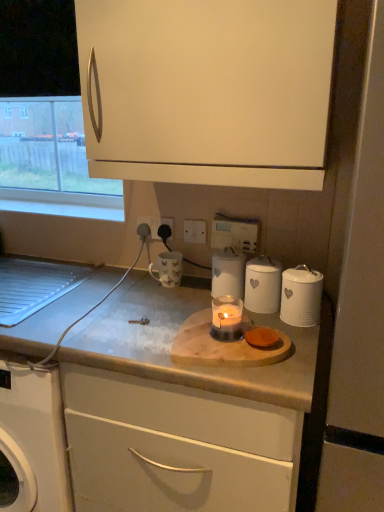
Question: Considering the relative positions of white ceramic canister at center, marked as the 3th kitchen appliance in a right-to-left arrangement, and clear glass window at upper left in the image provided, is white ceramic canister at center, marked as the 3th kitchen appliance in a right-to-left arrangement, to the left or to the right of clear glass window at upper left?

Choices:
 (A) right
 (B) left

Answer: (A)

Question: From a real-world perspective, relative to clear glass window at upper left, is white ceramic canister at center, marked as the 3th kitchen appliance in a right-to-left arrangement, vertically above or below?

Choices:
 (A) below
 (B) above

Answer: (A)

Question: Estimate the real-world distances between objects in this image. Which object is farther from the matte white cutting board at center, arranged as the first cabinetry when ordered from the bottom?

Choices:
 (A) white glossy mug at center
 (B) white plastic electric outlet at center, positioned as the 1th electric outlet in right-to-left order
 (C) white ceramic canister at center, marked as the first kitchen appliance in a left-to-right arrangement
 (D) translucent glass candle at center
 (E) white ceramic canister at right, the third kitchen appliance from the left

Answer: (B)

Question: Which object is positioned farthest from the translucent glass candle at center?

Choices:
 (A) white ceramic canister at center, marked as the first kitchen appliance in a left-to-right arrangement
 (B) white matte screen door at right
 (C) white glossy mug at center
 (D) white plastic electric outlet at center, acting as the second electric outlet starting from the left
 (E) clear glass window at upper left

Answer: (E)